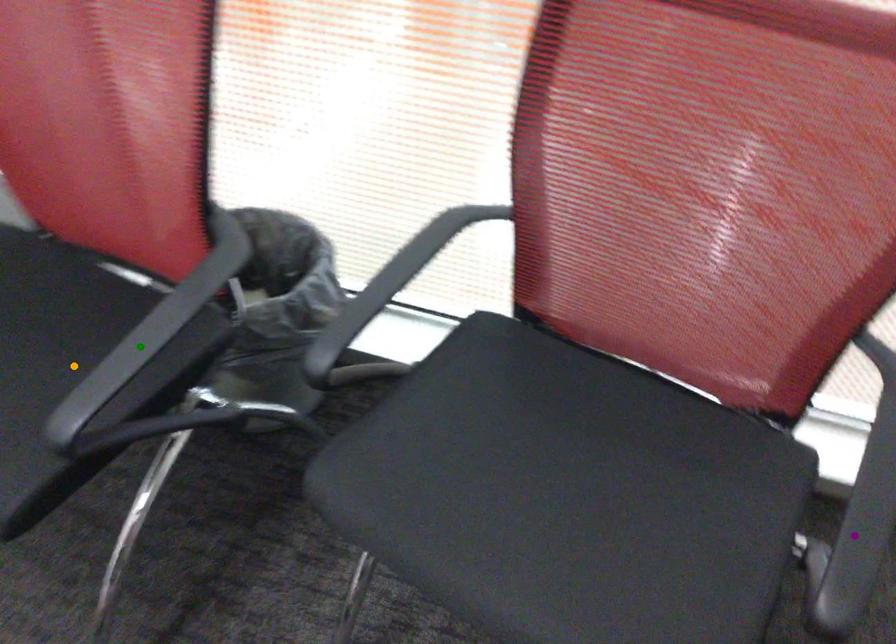
Order these from nearest to farthest:
purple point, green point, orange point

purple point, green point, orange point